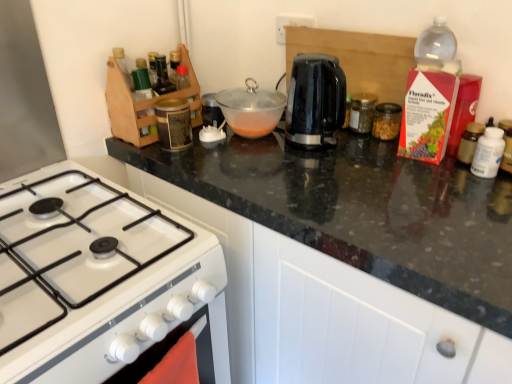
What do you see at coordinates (101, 282) in the screenshot? I see `white glossy gas stove at lower left` at bounding box center [101, 282].

The width and height of the screenshot is (512, 384). What do you see at coordinates (362, 112) in the screenshot?
I see `clear glass jar at center, which ranks as the 3th kitchen appliance in left-to-right order` at bounding box center [362, 112].

Where is `translucent plastic bottle at right, which is the 5th kitchen appliance from left to right`? The width and height of the screenshot is (512, 384). translucent plastic bottle at right, which is the 5th kitchen appliance from left to right is located at coordinates (469, 142).

You are a GUI agent. You are given a task and a screenshot of the screen. Output one action in this format:
    pyautogui.click(x=<x>, y=<y>)
    Task: Click on the white glossy gas stove at lower left
    
    Given the screenshot: What is the action you would take?
    pyautogui.click(x=101, y=282)

What's the angular difference between transparent glass bowl at center, arranged as the 5th kitchen appliance when viewed from the right, and clear glass jar at center, which ranks as the 3th kitchen appliance in left-to-right order,'s facing directions?

0.00209 degrees separate the facing orientations of transparent glass bowl at center, arranged as the 5th kitchen appliance when viewed from the right, and clear glass jar at center, which ranks as the 3th kitchen appliance in left-to-right order.

From a real-world perspective, is transparent glass bowl at center, positioned as the 1th kitchen appliance in left-to-right order, physically located above or below clear glass jar at center, which ranks as the 3th kitchen appliance in left-to-right order?

From a real-world perspective, transparent glass bowl at center, positioned as the 1th kitchen appliance in left-to-right order, is physically above clear glass jar at center, which ranks as the 3th kitchen appliance in left-to-right order.

Can you confirm if transparent glass bowl at center, arranged as the 5th kitchen appliance when viewed from the right, is positioned to the right of clear glass jar at center, which is the third kitchen appliance in right-to-left order?

In fact, transparent glass bowl at center, arranged as the 5th kitchen appliance when viewed from the right, is to the left of clear glass jar at center, which is the third kitchen appliance in right-to-left order.

From the image's perspective, would you say transparent glass bowl at center, positioned as the 1th kitchen appliance in left-to-right order, is shown under clear glass jar at center, which ranks as the 3th kitchen appliance in left-to-right order?

No, from the image's perspective, transparent glass bowl at center, positioned as the 1th kitchen appliance in left-to-right order, is not below clear glass jar at center, which ranks as the 3th kitchen appliance in left-to-right order.

How far apart are transparent glass bowl at center, arranged as the 5th kitchen appliance when viewed from the right, and black glossy electric kettle at center, which ranks as the 2th kitchen appliance in left-to-right order?

They are 13.88 centimeters apart.

Is black glossy electric kettle at center, which ranks as the 2th kitchen appliance in left-to-right order, inside transparent glass bowl at center, positioned as the 1th kitchen appliance in left-to-right order?

No, black glossy electric kettle at center, which ranks as the 2th kitchen appliance in left-to-right order, is not surrounded by transparent glass bowl at center, positioned as the 1th kitchen appliance in left-to-right order.

Is transparent glass bowl at center, arranged as the 5th kitchen appliance when viewed from the right, to the right of black glossy electric kettle at center, the fourth kitchen appliance viewed from the right, from the viewer's perspective?

No.

In terms of size, does transparent glass bowl at center, positioned as the 1th kitchen appliance in left-to-right order, appear bigger or smaller than black glossy electric kettle at center, the fourth kitchen appliance viewed from the right?

Clearly, transparent glass bowl at center, positioned as the 1th kitchen appliance in left-to-right order, is smaller in size than black glossy electric kettle at center, the fourth kitchen appliance viewed from the right.

Can you confirm if black granite countertop at upper center is positioned to the left of translucent plastic bottle at right, which is the 5th kitchen appliance from left to right?

Yes.

The image size is (512, 384). I want to click on countertop located below the translucent plastic bottle at right, which is the 1th kitchen appliance from right to left (from the image's perspective), so click(362, 211).

Is black granite countertop at upper center outside of translucent plastic bottle at right, which is the 5th kitchen appliance from left to right?

Absolutely, black granite countertop at upper center is external to translucent plastic bottle at right, which is the 5th kitchen appliance from left to right.

In the scene shown: Are black granite countertop at upper center and translucent plastic bottle at right, which is the 1th kitchen appliance from right to left, beside each other?

No, black granite countertop at upper center is not touching translucent plastic bottle at right, which is the 1th kitchen appliance from right to left.

From the picture: Could you tell me if clear glass jar at center-right, placed as the second kitchen appliance when sorted from right to left, is turned towards transparent glass bowl at center, positioned as the 1th kitchen appliance in left-to-right order?

No, clear glass jar at center-right, placed as the second kitchen appliance when sorted from right to left, is not aimed at transparent glass bowl at center, positioned as the 1th kitchen appliance in left-to-right order.

Where is `the 3rd kitchen appliance to the right of the transparent glass bowl at center, arranged as the 5th kitchen appliance when viewed from the right, counting from the anchor's position`? the 3rd kitchen appliance to the right of the transparent glass bowl at center, arranged as the 5th kitchen appliance when viewed from the right, counting from the anchor's position is located at coordinates (386, 121).

Which of these two, clear glass jar at center-right, placed as the second kitchen appliance when sorted from right to left, or transparent glass bowl at center, positioned as the 1th kitchen appliance in left-to-right order, is bigger?

Bigger between the two is transparent glass bowl at center, positioned as the 1th kitchen appliance in left-to-right order.

Which is behind, clear glass jar at center-right, placed as the second kitchen appliance when sorted from right to left, or transparent glass bowl at center, arranged as the 5th kitchen appliance when viewed from the right?

clear glass jar at center-right, placed as the second kitchen appliance when sorted from right to left, is more distant.

Identify the location of kitchen appliance that is the 2nd object located behind the white glossy gas stove at lower left. The width and height of the screenshot is (512, 384). (469, 142).

Would you say white glossy gas stove at lower left is outside translucent plastic bottle at right, which is the 5th kitchen appliance from left to right?

Yes, white glossy gas stove at lower left is outside of translucent plastic bottle at right, which is the 5th kitchen appliance from left to right.

Considering the positions of point (93, 294) and point (465, 142), is point (93, 294) closer or farther from the camera than point (465, 142)?

Point (93, 294).

From the image's perspective, between white glossy gas stove at lower left and translucent plastic bottle at right, which is the 5th kitchen appliance from left to right, who is located below?

From the image's view, white glossy gas stove at lower left is below.

Which object is wider, transparent glass bowl at center, arranged as the 5th kitchen appliance when viewed from the right, or white glossy gas stove at lower left?

Wider between the two is white glossy gas stove at lower left.

At what (x,y) coordinates should I click in order to perform the action: click on gas stove below the transparent glass bowl at center, arranged as the 5th kitchen appliance when viewed from the right (from a real-world perspective). Please return your answer as a coordinate pair (x, y). Looking at the image, I should click on (101, 282).

From a real-world perspective, who is located lower, transparent glass bowl at center, arranged as the 5th kitchen appliance when viewed from the right, or white glossy gas stove at lower left?

From a 3D spatial view, white glossy gas stove at lower left is below.

Can we say transparent glass bowl at center, positioned as the 1th kitchen appliance in left-to-right order, lies outside white glossy gas stove at lower left?

Yes.

How different are the orientations of black granite countertop at upper center and clear glass jar at center, which ranks as the 3th kitchen appliance in left-to-right order, in degrees?

The angle between the facing direction of black granite countertop at upper center and the facing direction of clear glass jar at center, which ranks as the 3th kitchen appliance in left-to-right order, is 0.00171 degrees.

Is black granite countertop at upper center facing away from clear glass jar at center, which is the third kitchen appliance in right-to-left order?

black granite countertop at upper center does not have its back to clear glass jar at center, which is the third kitchen appliance in right-to-left order.

Is clear glass jar at center, which ranks as the 3th kitchen appliance in left-to-right order, a part of black granite countertop at upper center?

Definitely not — clear glass jar at center, which ranks as the 3th kitchen appliance in left-to-right order, is not inside black granite countertop at upper center.

Based on the photo, can you confirm if black granite countertop at upper center is positioned to the right of clear glass jar at center, which ranks as the 3th kitchen appliance in left-to-right order?

Incorrect, black granite countertop at upper center is not on the right side of clear glass jar at center, which ranks as the 3th kitchen appliance in left-to-right order.

There is a transparent glass bowl at center, positioned as the 1th kitchen appliance in left-to-right order. Where is `the 2nd kitchen appliance below it (from the image's perspective)`? Image resolution: width=512 pixels, height=384 pixels. the 2nd kitchen appliance below it (from the image's perspective) is located at coordinates (362, 112).

Locate an element on the screen. The width and height of the screenshot is (512, 384). kitchen appliance that is the 2nd object located behind the black glossy electric kettle at center, which ranks as the 2th kitchen appliance in left-to-right order is located at coordinates click(251, 109).

Consider the image. Which object lies further to the anchor point translucent plastic bottle at right, which is the 1th kitchen appliance from right to left, transparent glass bowl at center, positioned as the 1th kitchen appliance in left-to-right order, or black glossy electric kettle at center, which ranks as the 2th kitchen appliance in left-to-right order?

transparent glass bowl at center, positioned as the 1th kitchen appliance in left-to-right order, lies further to translucent plastic bottle at right, which is the 1th kitchen appliance from right to left, than the other object.

From the image, which object appears to be nearer to translucent plastic bottle at right, which is the 1th kitchen appliance from right to left, clear glass jar at center-right, placed as the second kitchen appliance when sorted from right to left, or black granite countertop at upper center?

Based on the image, clear glass jar at center-right, placed as the second kitchen appliance when sorted from right to left, appears to be nearer to translucent plastic bottle at right, which is the 1th kitchen appliance from right to left.

Which object lies nearer to the anchor point white glossy gas stove at lower left, translucent plastic bottle at right, which is the 1th kitchen appliance from right to left, or clear glass jar at center-right, placed as the second kitchen appliance when sorted from right to left?

Based on the image, clear glass jar at center-right, placed as the second kitchen appliance when sorted from right to left, appears to be nearer to white glossy gas stove at lower left.

Looking at the image, which one is located further to clear glass jar at center, which ranks as the 3th kitchen appliance in left-to-right order, black glossy electric kettle at center, the fourth kitchen appliance viewed from the right, or translucent plastic bottle at right, which is the 1th kitchen appliance from right to left?

translucent plastic bottle at right, which is the 1th kitchen appliance from right to left, lies further to clear glass jar at center, which ranks as the 3th kitchen appliance in left-to-right order, than the other object.

Estimate the real-world distances between objects in this image. Which object is closer to clear glass jar at center-right, placed as the second kitchen appliance when sorted from right to left, translucent plastic bottle at right, which is the 5th kitchen appliance from left to right, or clear glass jar at center, which is the third kitchen appliance in right-to-left order?

clear glass jar at center, which is the third kitchen appliance in right-to-left order, is positioned closer to the anchor clear glass jar at center-right, placed as the second kitchen appliance when sorted from right to left.

Considering their positions, is black granite countertop at upper center positioned closer to translucent plastic bottle at right, which is the 5th kitchen appliance from left to right, than transparent glass bowl at center, positioned as the 1th kitchen appliance in left-to-right order?

black granite countertop at upper center is closer to translucent plastic bottle at right, which is the 5th kitchen appliance from left to right.

Looking at the image, which one is located closer to black glossy electric kettle at center, the fourth kitchen appliance viewed from the right, translucent plastic bottle at right, which is the 5th kitchen appliance from left to right, or white glossy gas stove at lower left?

translucent plastic bottle at right, which is the 5th kitchen appliance from left to right, is closer to black glossy electric kettle at center, the fourth kitchen appliance viewed from the right.

Based on their spatial positions, is black granite countertop at upper center or white glossy gas stove at lower left closer to translucent plastic bottle at right, which is the 1th kitchen appliance from right to left?

Among the two, black granite countertop at upper center is located nearer to translucent plastic bottle at right, which is the 1th kitchen appliance from right to left.

At what (x,y) coordinates should I click in order to perform the action: click on kitchen appliance situated between transparent glass bowl at center, positioned as the 1th kitchen appliance in left-to-right order, and clear glass jar at center, which is the third kitchen appliance in right-to-left order, from left to right. Please return your answer as a coordinate pair (x, y). This screenshot has height=384, width=512. Looking at the image, I should click on (315, 100).

Locate an element on the screen. The width and height of the screenshot is (512, 384). countertop between white glossy gas stove at lower left and clear glass jar at center, which is the third kitchen appliance in right-to-left order, in the horizontal direction is located at coordinates (362, 211).

Where is `kitchen appliance between white glossy gas stove at lower left and black glossy electric kettle at center, which ranks as the 2th kitchen appliance in left-to-right order`? The image size is (512, 384). kitchen appliance between white glossy gas stove at lower left and black glossy electric kettle at center, which ranks as the 2th kitchen appliance in left-to-right order is located at coordinates (251, 109).

At what (x,y) coordinates should I click in order to perform the action: click on countertop located between white glossy gas stove at lower left and transparent glass bowl at center, arranged as the 5th kitchen appliance when viewed from the right, in the depth direction. Please return your answer as a coordinate pair (x, y). The height and width of the screenshot is (384, 512). Looking at the image, I should click on (362, 211).